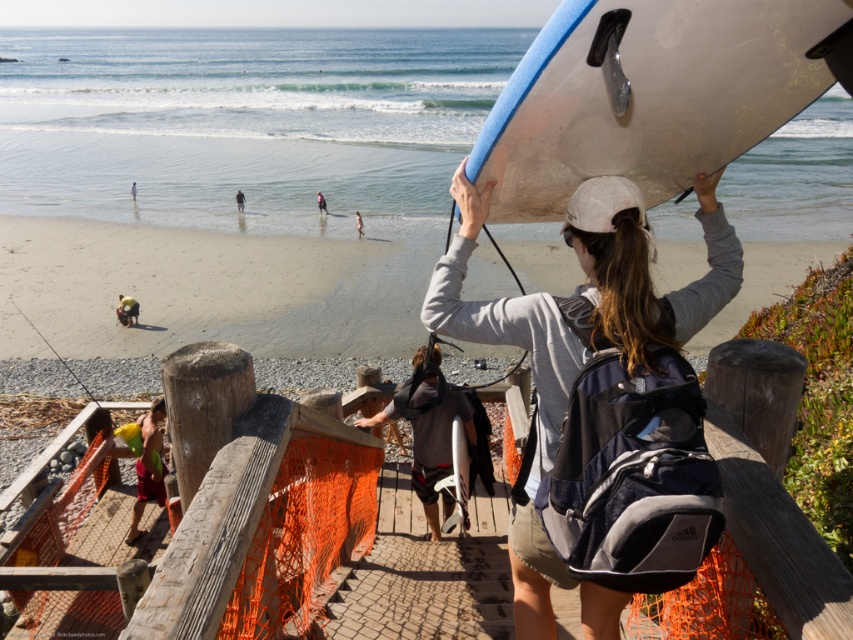
Question: Which point is farther to the camera?

Choices:
 (A) matte black surfboard at upper center
 (B) white cotton shirt at lower left

Answer: (B)

Question: Considering the relative positions of matte black surfboard at upper center and pink fabric at lower center in the image provided, where is matte black surfboard at upper center located with respect to pink fabric at lower center?

Choices:
 (A) above
 (B) below

Answer: (B)

Question: Observing the image, what is the correct spatial positioning of dark brown fur at lower left in reference to white cotton shirt at lower left?

Choices:
 (A) left
 (B) right

Answer: (B)

Question: Is dark brown fur at lower left wider than pink fabric at lower center?

Choices:
 (A) no
 (B) yes

Answer: (B)

Question: Which point appears closest to the camera in this image?

Choices:
 (A) (136, 308)
 (B) (132, 189)

Answer: (A)

Question: Which object is the farthest from the matte black surfboard at upper center?

Choices:
 (A) dark blue wetsuit at lower center
 (B) pink fabric at lower center

Answer: (A)